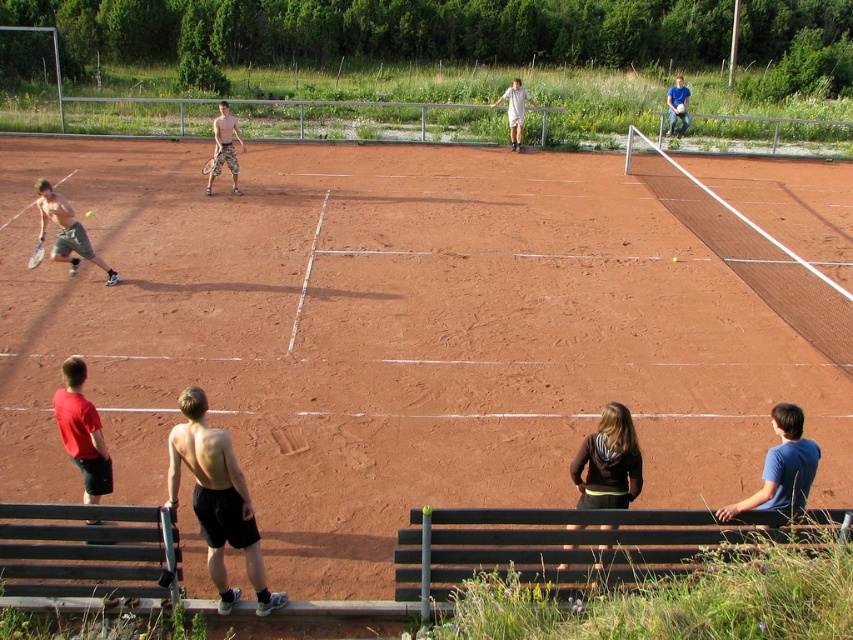
Who is shorter, brown hoodie at lower center or red matte shorts at lower left?

Standing shorter between the two is red matte shorts at lower left.

Can you confirm if brown hoodie at lower center is positioned to the right of red matte shorts at lower left?

Correct, you'll find brown hoodie at lower center to the right of red matte shorts at lower left.

The width and height of the screenshot is (853, 640). Describe the element at coordinates (608, 461) in the screenshot. I see `brown hoodie at lower center` at that location.

Identify the location of brown hoodie at lower center. (608, 461).

Is brown clay tennis court at center taller than brown hoodie at lower center?

Yes, brown clay tennis court at center is taller than brown hoodie at lower center.

Identify the location of brown clay tennis court at center. The width and height of the screenshot is (853, 640). (392, 339).

Is point (732, 294) positioned after point (605, 525)?

Yes, it is.

Where is `brown clay tennis court at center`? This screenshot has width=853, height=640. brown clay tennis court at center is located at coordinates (392, 339).

Does brown wooden bench at lower left have a smaller size compared to brown hoodie at lower center?

No.

Is brown wooden bench at lower left taller than brown hoodie at lower center?

No.

Which is behind, point (12, 529) or point (595, 477)?

Positioned behind is point (595, 477).

Image resolution: width=853 pixels, height=640 pixels. In order to click on brown wooden bench at lower left in this screenshot , I will do `click(90, 552)`.